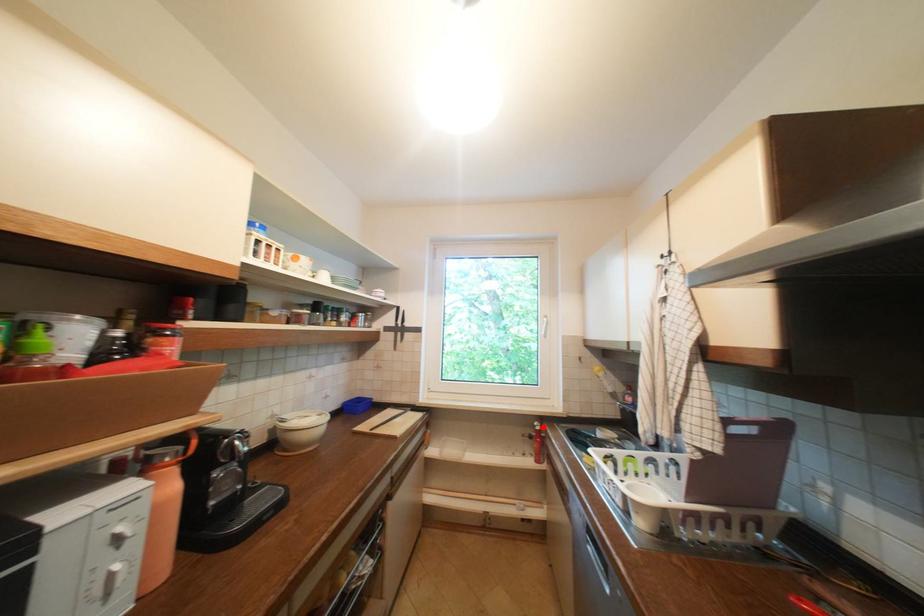
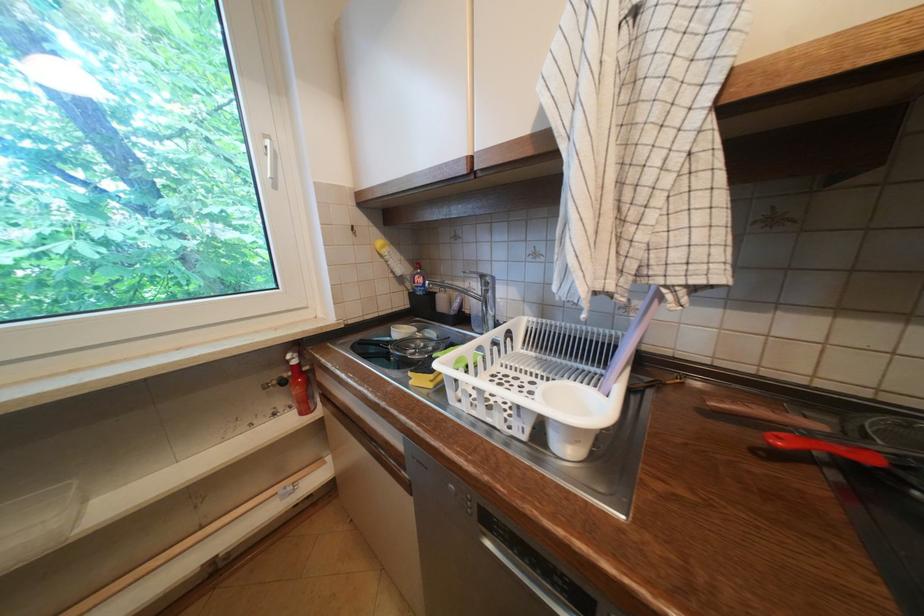
In the second image, find the point that corresponds to the highlighted location in the first image.

(296, 362)